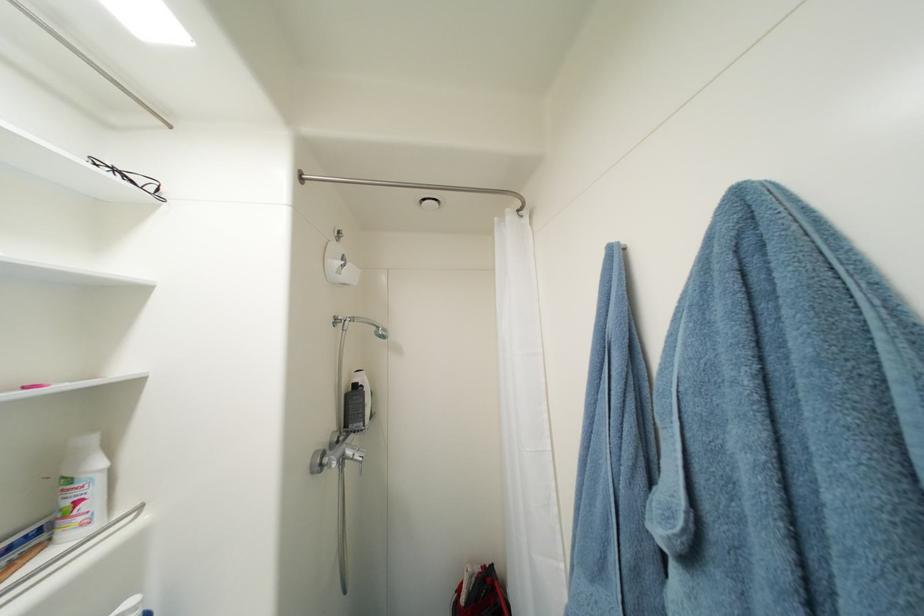
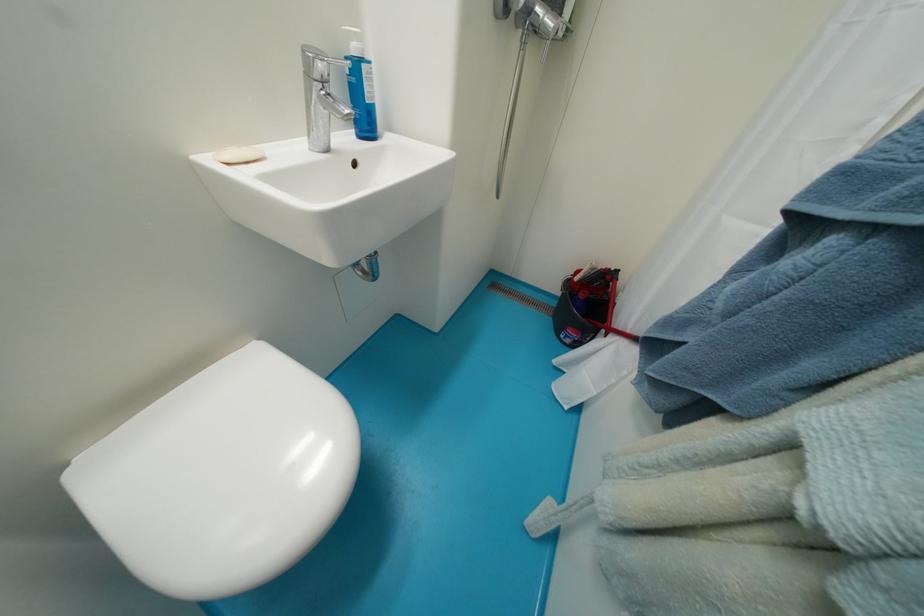
First-person continuous shooting, in which direction is the camera rotating?

The camera rotated toward left-down.